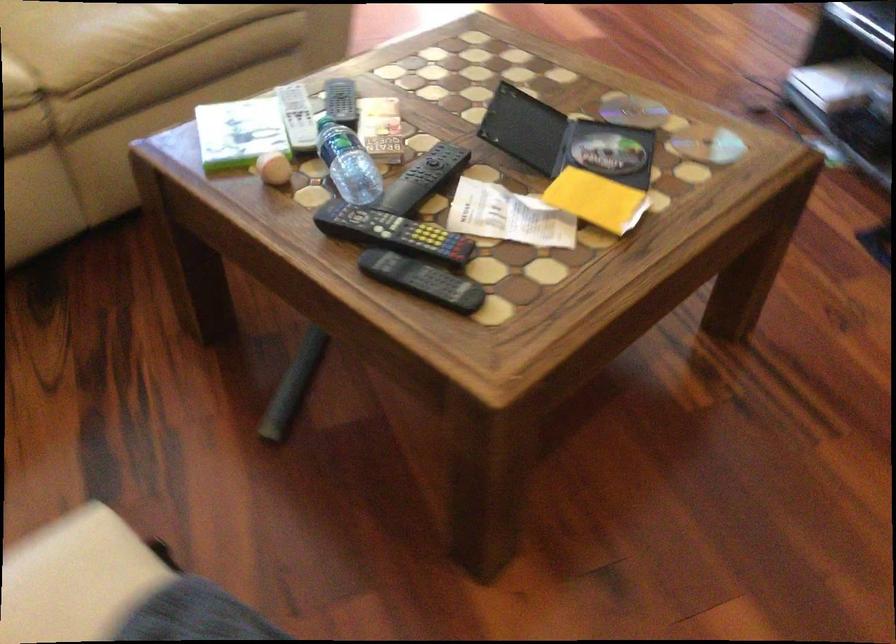
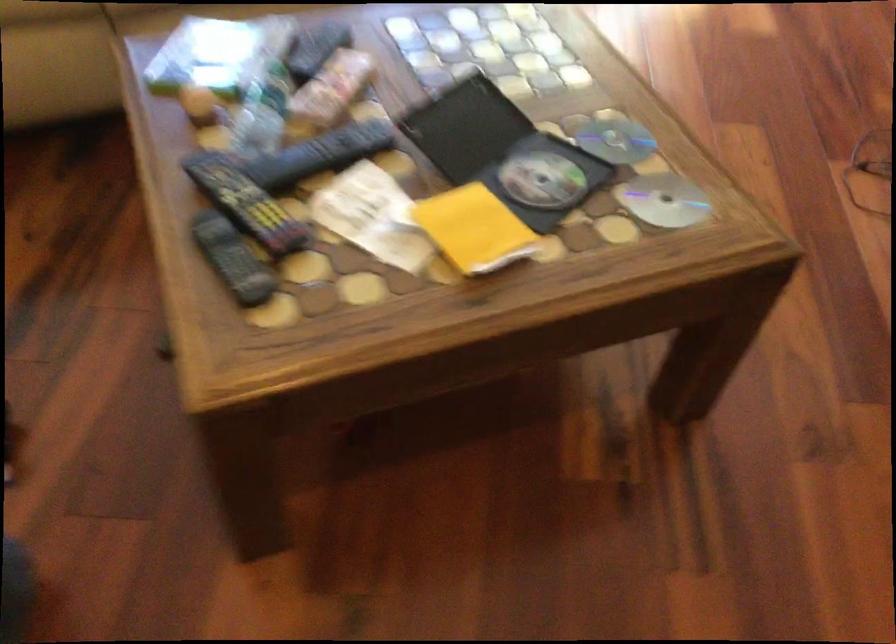
In the second image, find the point that corresponds to [428,277] in the first image.

(233, 259)